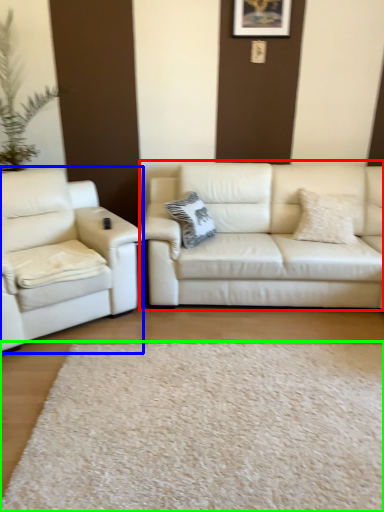
Question: Considering the real-world distances, which object is closest to studio couch (highlighted by a red box)? studio couch (highlighted by a blue box) or plain (highlighted by a green box).

Choices:
 (A) studio couch
 (B) plain

Answer: (A)